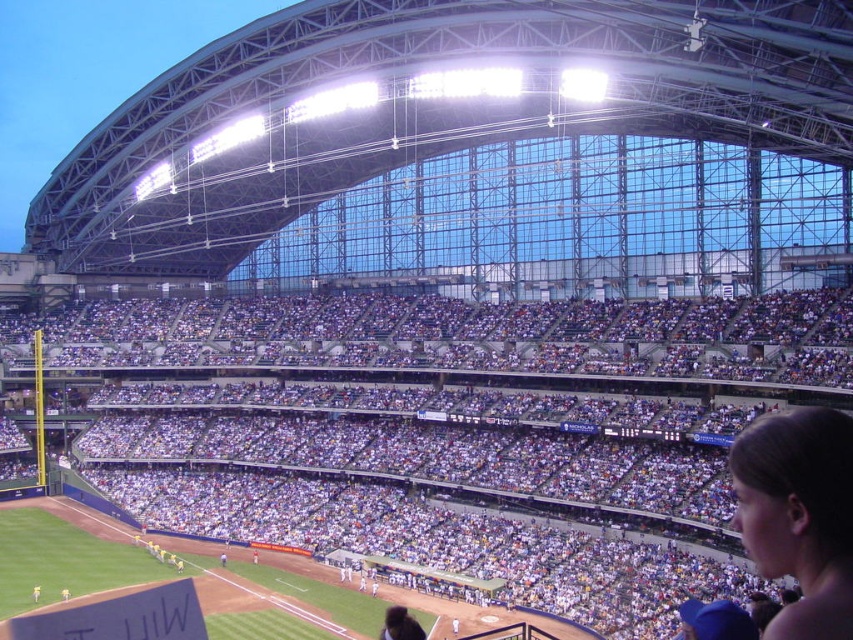
Consider the image. Does white fabric crowd at center have a lesser width compared to brown hair at upper right?

No.

Consider the image. Who is lower down, white fabric crowd at center or brown hair at upper right?

brown hair at upper right is lower down.

Locate an element on the screen. The image size is (853, 640). white fabric crowd at center is located at coordinates (421, 401).

Locate an element on the screen. The width and height of the screenshot is (853, 640). white fabric crowd at center is located at coordinates (421, 401).